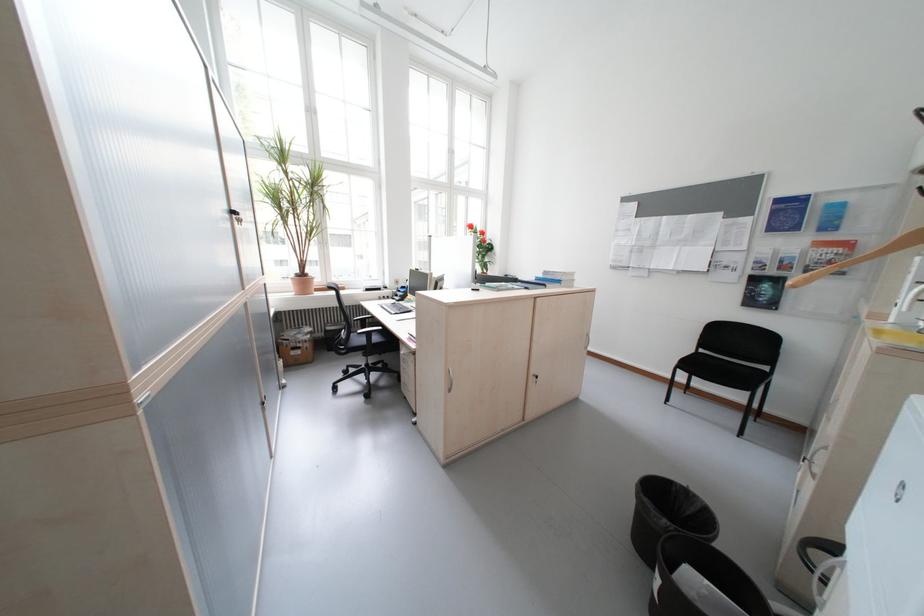
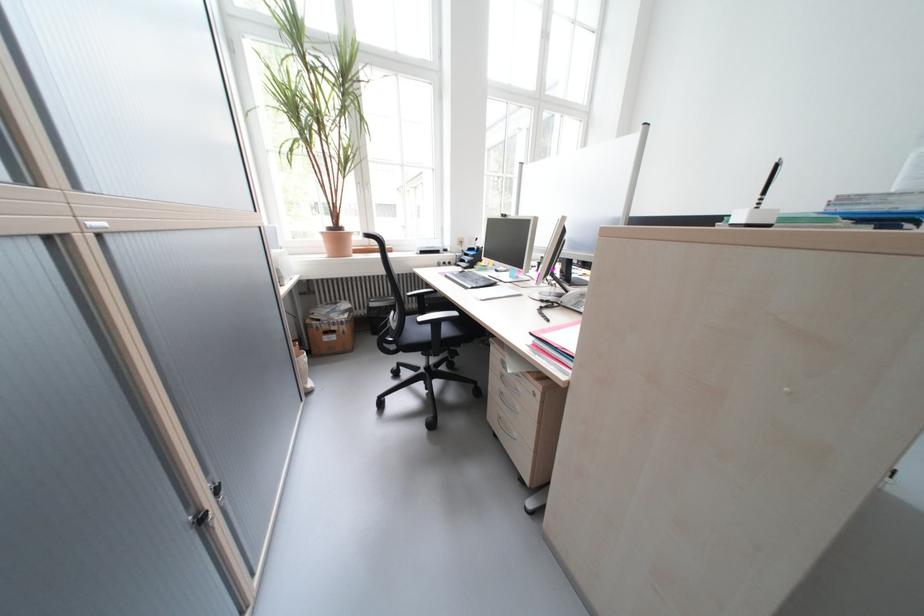
Question: I am providing you with two images of the same scene from different viewpoints. After the viewpoint changes to image2, which objects are now occluded?

Choices:
 (A) black chair armrest
 (B) cardboard box
 (C) red binder
 (D) none of these

Answer: (D)